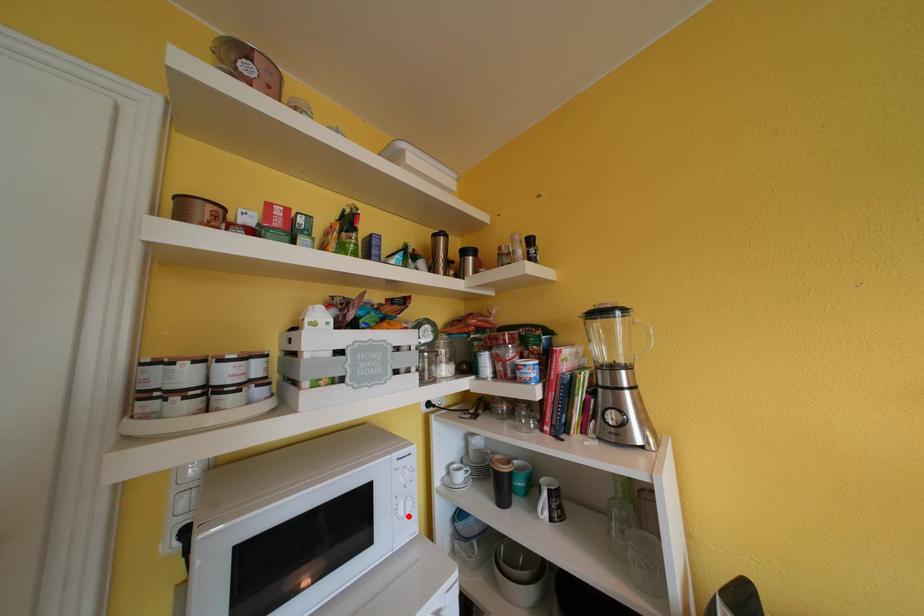
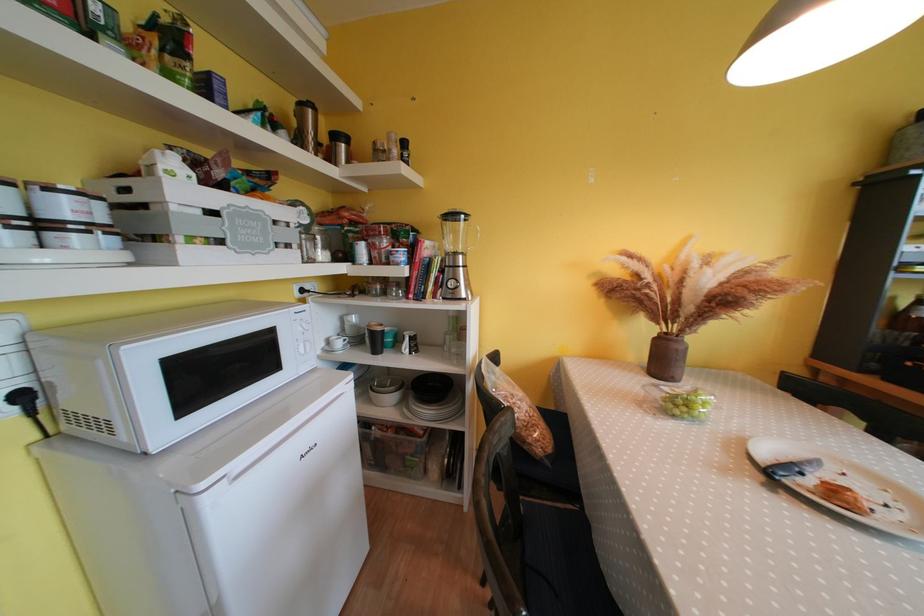
In the second image, find the point that corresponds to the highlighted location in the first image.

(309, 355)